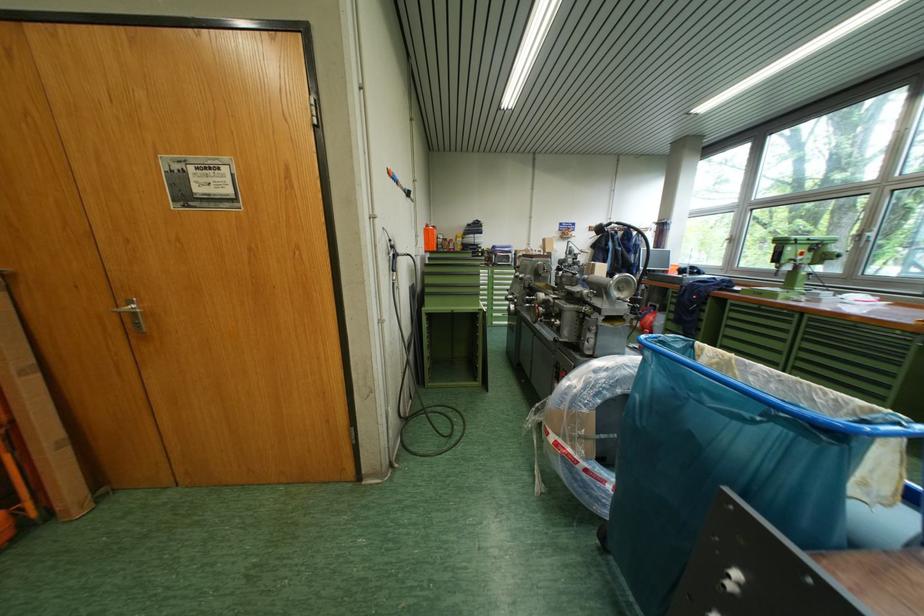
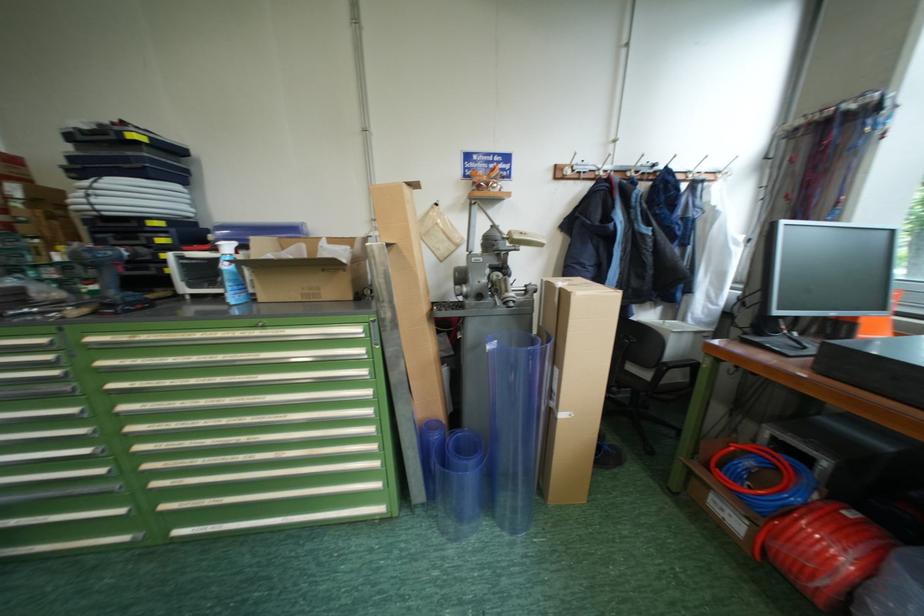
In a continuous first-person perspective shot, in which direction is the camera moving?

The cameraman walked toward right, forward.